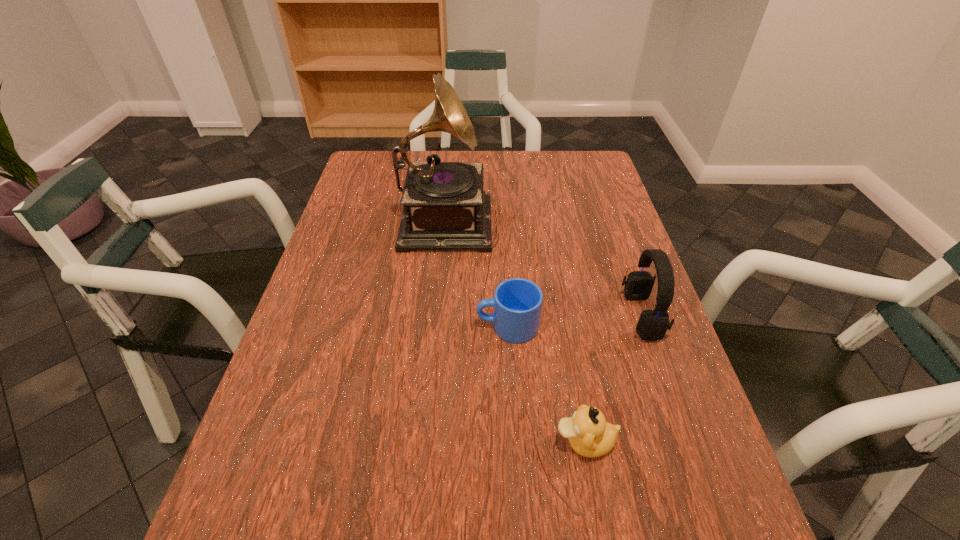
Image resolution: width=960 pixels, height=540 pixels. I want to click on record player, so click(445, 207).

Locate an element on the screen. The width and height of the screenshot is (960, 540). the tallest object is located at coordinates (445, 207).

Find the location of `headset`. headset is located at coordinates [x=653, y=324].

Identify the location of the rightmost object. (653, 324).

Locate an element on the screen. The image size is (960, 540). duckling is located at coordinates (589, 434).

Image resolution: width=960 pixels, height=540 pixels. I want to click on the nearest object, so click(589, 434).

Locate an element on the screen. The width and height of the screenshot is (960, 540). mug is located at coordinates (517, 302).

Locate an element on the screen. This screenshot has height=540, width=960. vacant area situated 0.100m on the horn of the record player is located at coordinates (525, 217).

I want to click on free location located 0.160m on the headband of the headset, so click(x=556, y=315).

Locate an element on the screen. The height and width of the screenshot is (540, 960). vacant region located on the headband of the headset is located at coordinates (498, 315).